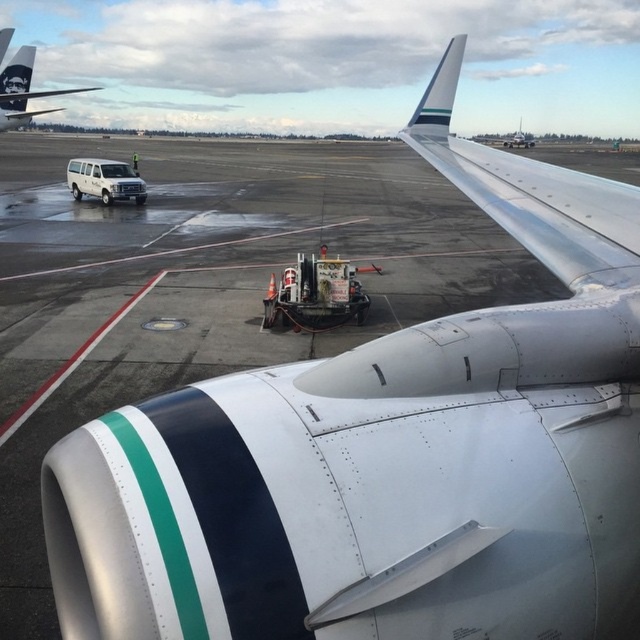
Question: Among these points, which one is farthest from the camera?

Choices:
 (A) (19, 80)
 (B) (561, 193)
 (C) (92, 172)

Answer: (A)

Question: Is silver metallic wing at upper right wider than white matte van at left?

Choices:
 (A) yes
 (B) no

Answer: (B)

Question: Does silver metallic wing at upper right have a lesser width compared to matte black airplane at upper left?

Choices:
 (A) yes
 (B) no

Answer: (A)

Question: Which of these objects is positioned farthest from the white matte van at left?

Choices:
 (A) matte black airplane at upper left
 (B) silver metallic wing at upper right

Answer: (B)

Question: Is matte black airplane at upper left below white matte van at left?

Choices:
 (A) yes
 (B) no

Answer: (B)

Question: Among these points, which one is nearest to the camera?

Choices:
 (A) (122, 180)
 (B) (3, 83)

Answer: (A)